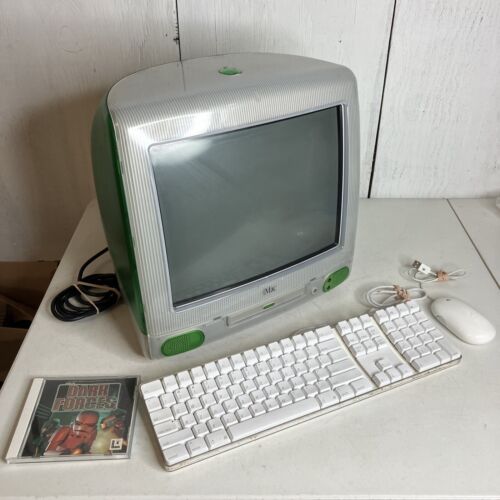
This screenshot has width=500, height=500. I want to click on keyboard, so click(x=255, y=390).